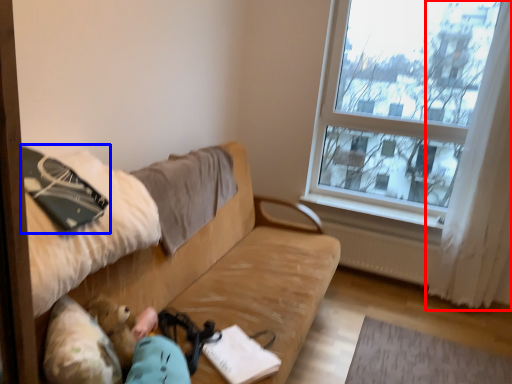
Question: Which object appears closest to the camera in this image, curtain (highlighted by a red box) or notebook (highlighted by a blue box)?

Choices:
 (A) curtain
 (B) notebook

Answer: (B)